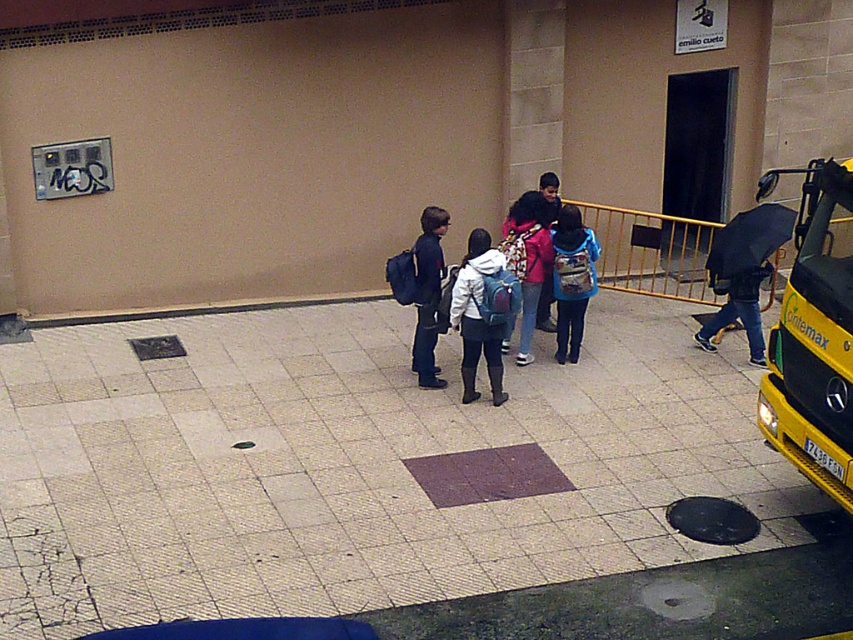
Based on the photo, is yellow metallic bus at right wider than matte pink jacket at center?

Yes, yellow metallic bus at right is wider than matte pink jacket at center.

Who is more forward, (849,278) or (525,273)?

Point (849,278) is in front.

The width and height of the screenshot is (853, 640). Identify the location of yellow metallic bus at right. (814, 337).

Locate an element on the screen. This screenshot has height=640, width=853. blue backpack at center is located at coordinates (573, 282).

Can you confirm if yellow metallic bus at right is positioned above matte blue backpack at center?

No.

Describe the element at coordinates (814, 337) in the screenshot. I see `yellow metallic bus at right` at that location.

Is point (776, 342) positioned behind point (471, 312)?

No.

The height and width of the screenshot is (640, 853). What are the coordinates of `yellow metallic bus at right` in the screenshot? It's located at (814, 337).